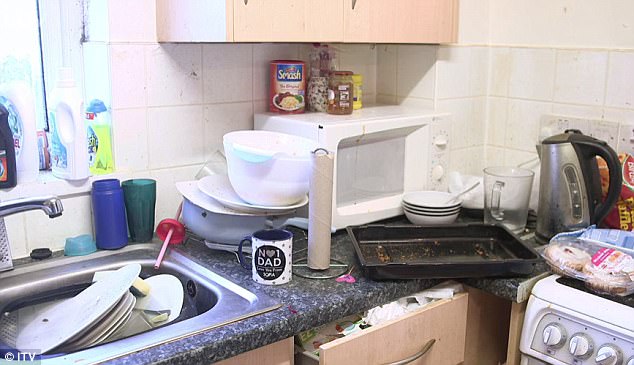
Image resolution: width=634 pixels, height=365 pixels. Find the location of `measuring cup`. measuring cup is located at coordinates (512, 192).